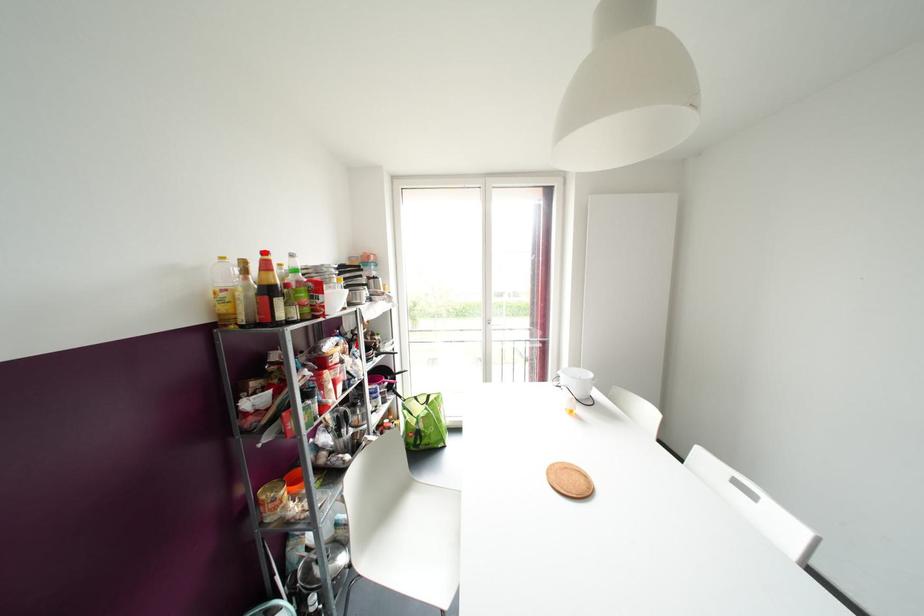
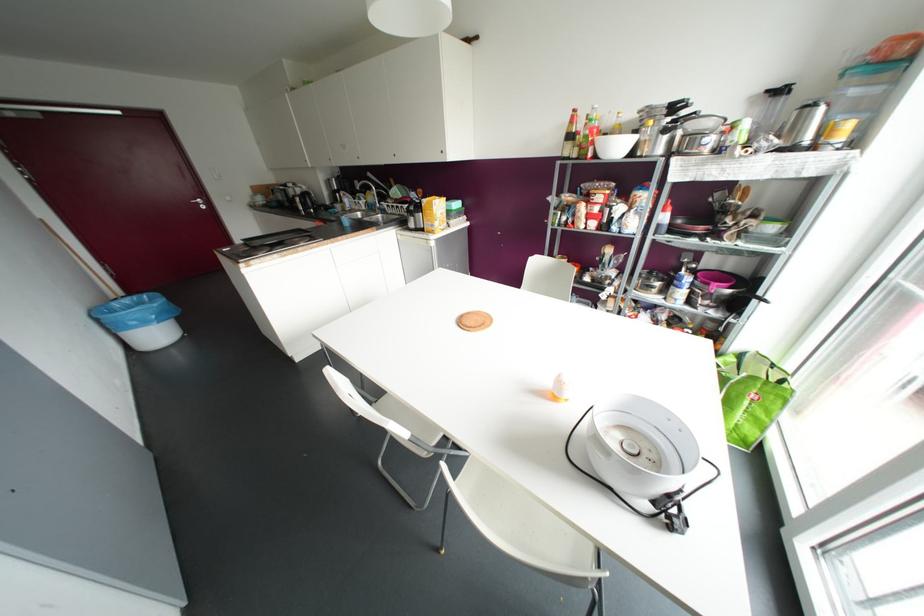
Locate, in the second image, the point that corresponds to the highlighted location in the first image.

(574, 110)